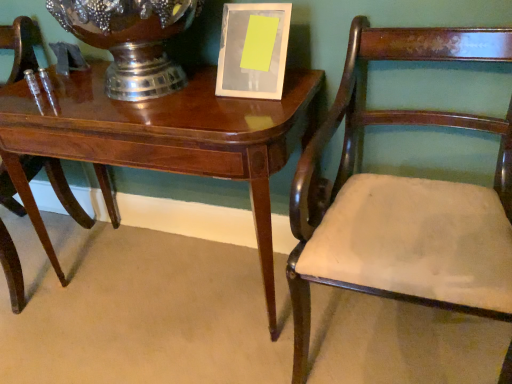
Identify the location of vacant area that lies between brushed metal vase at upper center and white glossy picture frame at upper center. The image size is (512, 384). (222, 104).